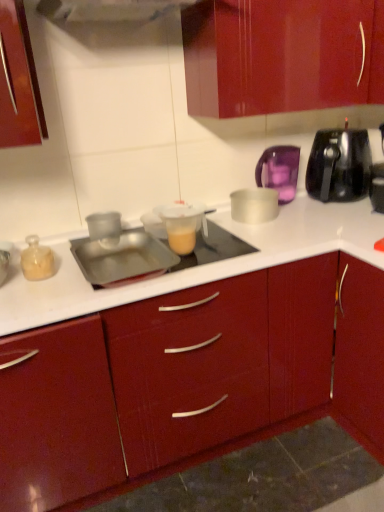
The width and height of the screenshot is (384, 512). Find the location of `free location in front of translucent glass jar at left, which is the 1th kitchen appliance from left to right`. free location in front of translucent glass jar at left, which is the 1th kitchen appliance from left to right is located at coordinates (44, 300).